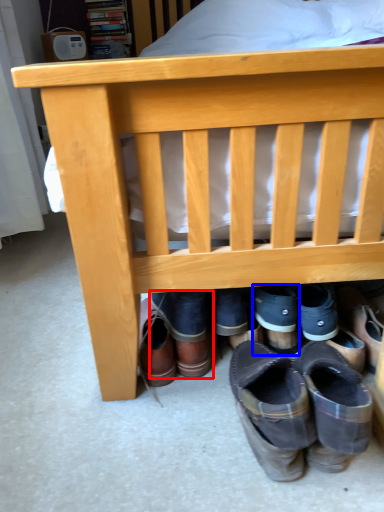
Question: Which object is further to the camera taking this photo, footwear (highlighted by a red box) or footwear (highlighted by a blue box)?

Choices:
 (A) footwear
 (B) footwear

Answer: (B)